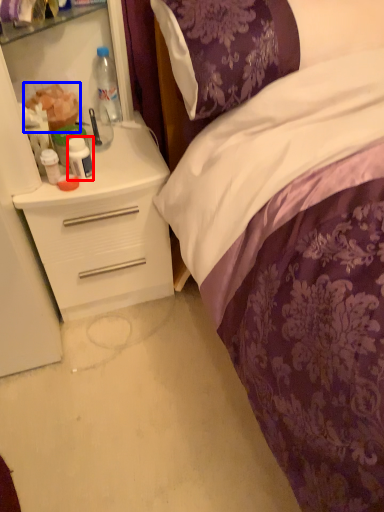
Question: Which object is closer to the camera taking this photo, bottle (highlighted by a red box) or food (highlighted by a blue box)?

Choices:
 (A) bottle
 (B) food

Answer: (A)